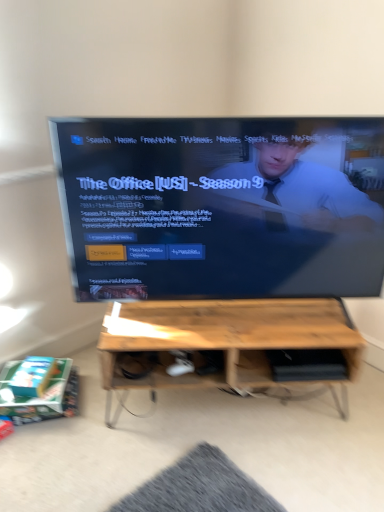
Identify the location of free location in front of wooden table at center. The image size is (384, 512). (231, 465).